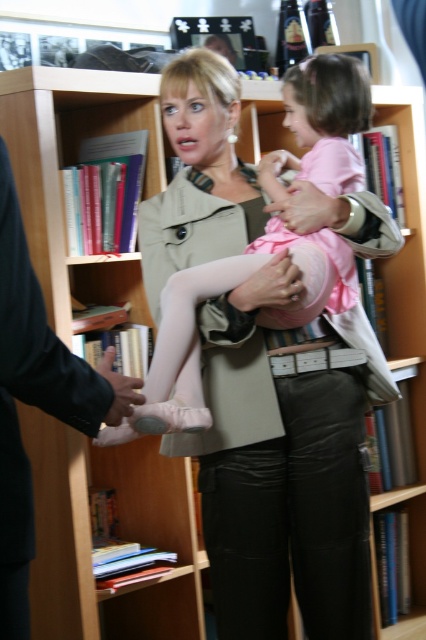
Question: Does matte beige hand at center have a larger size compared to black leather hand at lower left?

Choices:
 (A) no
 (B) yes

Answer: (A)

Question: Among these points, which one is nearest to the camera?

Choices:
 (A) (261, 292)
 (B) (112, 381)

Answer: (B)

Question: Considering the real-world distances, which object is farthest from the dark gray suit at left?

Choices:
 (A) pink satin dress at center
 (B) black leather hand at lower left

Answer: (A)

Question: Is dark gray suit at left positioned in front of black leather hand at lower left?

Choices:
 (A) yes
 (B) no

Answer: (A)

Question: Which point is closer to the camera?

Choices:
 (A) (22, 260)
 (B) (264, 276)
 (C) (120, 381)
 (D) (290, 104)

Answer: (A)

Question: Is pink satin dress at center smaller than black leather hand at lower left?

Choices:
 (A) no
 (B) yes

Answer: (A)